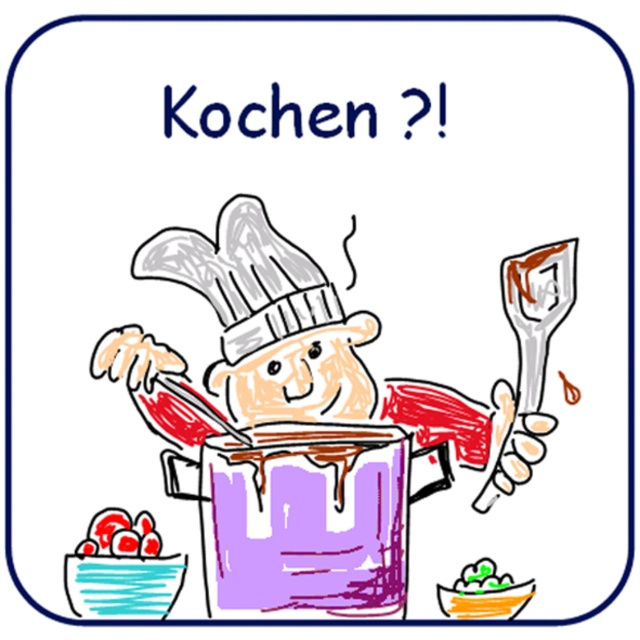
You have a smooth red tomatoes at lower left and a green matte bowl at lower center. Which object is wider?

The green matte bowl at lower center might be wider than smooth red tomatoes at lower left.

From the picture: Based on the scene description, where is the smooth red chef at center located in the image?

The smooth red chef at center is located at point [323,364] in the image.